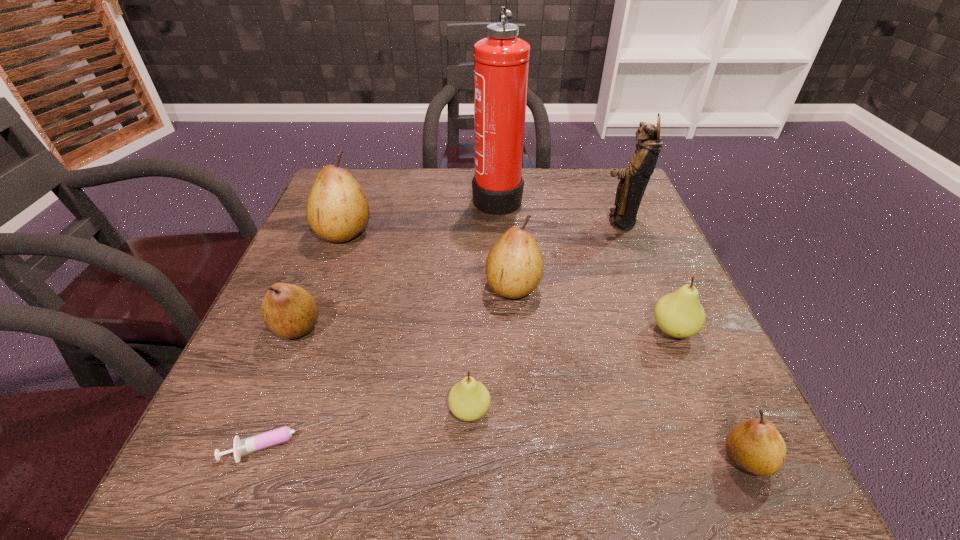
This screenshot has width=960, height=540. I want to click on unoccupied position between the tallest pear and the third farthest brown pear, so click(x=321, y=279).

You are a GUI agent. You are given a task and a screenshot of the screen. Output one action in this format:
    pyautogui.click(x=<x>, y=<y>)
    Task: Click on the vacant area between the figurine and the shortest object
    This screenshot has height=540, width=960.
    Given the screenshot: What is the action you would take?
    pyautogui.click(x=448, y=333)

Find the location of a particular element. object that stands as the third closest to the tallest object is located at coordinates (337, 210).

Identify the location of the eighth closest object to the fire extinguisher. (755, 445).

Image resolution: width=960 pixels, height=540 pixels. I want to click on pear that is the third closest to the tallest object, so click(x=680, y=315).

Point out which pear is positioned as the fifth nearest to the left green pear. Please provide its 2D coordinates. Your answer should be formatted as a tuple, i.e. [(x, y)], where the tuple contains the x and y coordinates of a point satisfying the conditions above.

[(337, 210)]

Where is `the fourth closest brown pear relative to the syringe`? The height and width of the screenshot is (540, 960). the fourth closest brown pear relative to the syringe is located at coordinates (755, 445).

Choose which brown pear is the nearest neighbor to the bigger green pear. Please provide its 2D coordinates. Your answer should be formatted as a tuple, i.e. [(x, y)], where the tuple contains the x and y coordinates of a point satisfying the conditions above.

[(755, 445)]

The image size is (960, 540). I want to click on vacant position in the image that satisfies the following two spatial constraints: 1. on the front-facing side of the figurine; 2. on the front side of the left green pear, so click(x=696, y=411).

The width and height of the screenshot is (960, 540). Find the location of `vacant space that satisfies the following two spatial constraints: 1. on the front-facing side of the red fire extinguisher; 2. on the right side of the rightmost brown pear`. vacant space that satisfies the following two spatial constraints: 1. on the front-facing side of the red fire extinguisher; 2. on the right side of the rightmost brown pear is located at coordinates (512, 458).